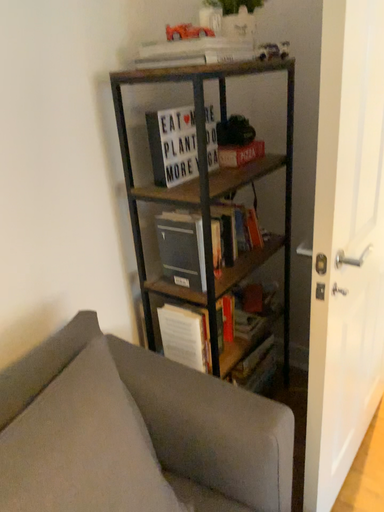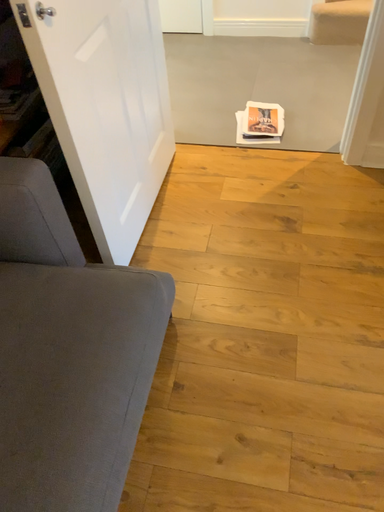
Question: Which way did the camera rotate in the video?

Choices:
 (A) rotated downward
 (B) rotated upward

Answer: (A)